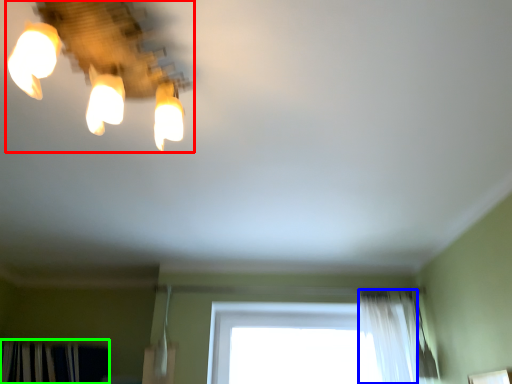
Question: Based on their relative distances, which object is farther from lamp (highlighted by a red box)? Choose from shower curtain (highlighted by a blue box) and curtain (highlighted by a green box).

Choices:
 (A) shower curtain
 (B) curtain

Answer: (B)